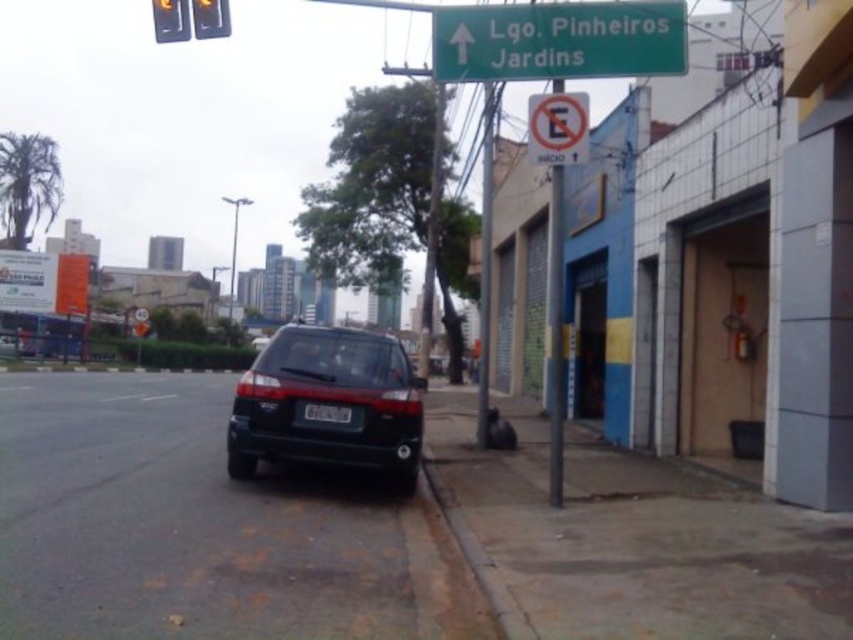
Question: Among these objects, which one is farthest from the camera?

Choices:
 (A) shiny black suv at center
 (B) metallic rectangular traffic light at upper center

Answer: (B)

Question: Is shiny black suv at center smaller than metallic pole at center?

Choices:
 (A) no
 (B) yes

Answer: (B)

Question: Among these points, which one is nearest to the camera?

Choices:
 (A) (340, 419)
 (B) (561, 170)
 (C) (379, 346)
 (D) (167, 26)

Answer: (B)

Question: Which object is closer to the camera taking this photo?

Choices:
 (A) black plastic license plate at center
 (B) red plastic sign at upper center
 (C) shiny black suv at center
 (D) metallic rectangular traffic light at upper center

Answer: (B)

Question: Is shiny black suv at center to the right of black plastic license plate at center from the viewer's perspective?

Choices:
 (A) no
 (B) yes

Answer: (A)

Question: Is metallic pole at center smaller than satin black suv at center?

Choices:
 (A) yes
 (B) no

Answer: (B)